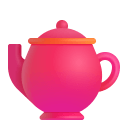
The height and width of the screenshot is (128, 128). What are the coordinates of `empty space top left of tea pot` in the screenshot? It's located at (24, 25).